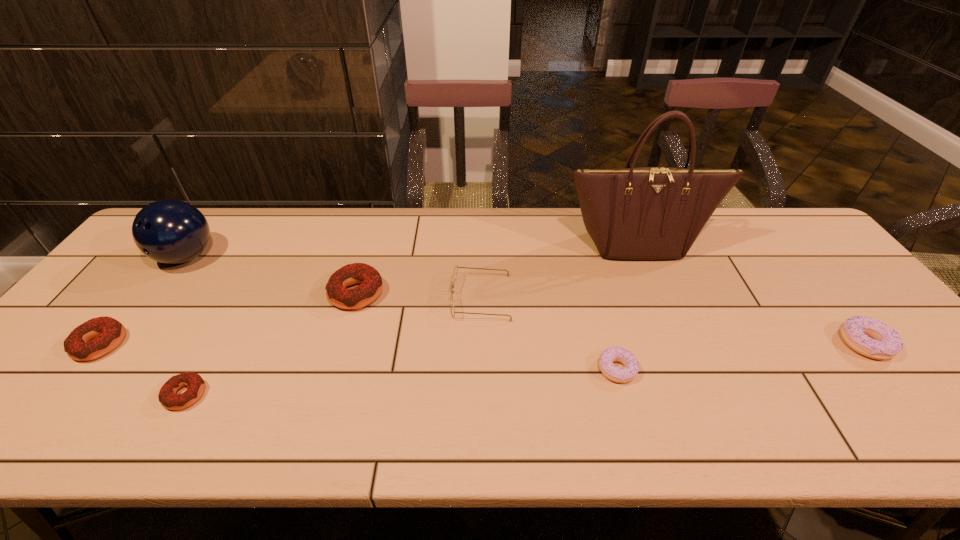
Image resolution: width=960 pixels, height=540 pixels. What are the coordinates of `free space located on the front-facing side of the fourth object from right to left` in the screenshot? It's located at (392, 298).

Locate an element on the screen. Image resolution: width=960 pixels, height=540 pixels. vacant position located 0.140m on the front of the rightmost doughnut is located at coordinates (925, 418).

Find the location of a particular element. vacant space located on the back of the leftmost chocolate doughnut is located at coordinates tap(135, 300).

At what (x,y) coordinates should I click in order to perform the action: click on vacant space located 0.250m on the back of the left purple doughnut. Please return your answer as a coordinate pair (x, y). The height and width of the screenshot is (540, 960). Looking at the image, I should click on (593, 282).

I want to click on free space located on the right of the smallest chocolate doughnut, so click(255, 395).

Find the location of a particular element. The width and height of the screenshot is (960, 540). handbag present at the far edge is located at coordinates (647, 213).

This screenshot has height=540, width=960. In order to click on bowling ball situated at the far edge in this screenshot , I will do `click(168, 231)`.

This screenshot has width=960, height=540. I want to click on object present at the near edge, so click(x=195, y=384).

I want to click on bowling ball that is at the left edge, so click(x=168, y=231).

I want to click on doughnut located in the left edge section of the desktop, so click(109, 332).